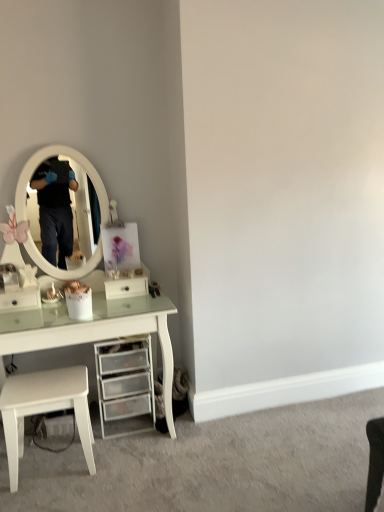
Question: Would you say white glossy drawer at center, the 1th drawer positioned from the right, is part of white glossy drawer at left, which appears as the 2th drawer when viewed from the right,'s contents?

Choices:
 (A) yes
 (B) no

Answer: (B)

Question: Could you tell me if white glossy drawer at left, which appears as the 2th drawer when viewed from the right, is turned towards white glossy drawer at center, the 1th drawer positioned from the right?

Choices:
 (A) no
 (B) yes

Answer: (A)

Question: From a real-world perspective, is white glossy drawer at left, which is the first drawer in left-to-right order, beneath white glossy drawer at center, marked as the second drawer in a left-to-right arrangement?

Choices:
 (A) yes
 (B) no

Answer: (B)

Question: Is white glossy drawer at left, which is the first drawer in left-to-right order, positioned with its back to white glossy drawer at center, marked as the second drawer in a left-to-right arrangement?

Choices:
 (A) no
 (B) yes

Answer: (A)

Question: Can you confirm if white glossy drawer at left, which is the first drawer in left-to-right order, is taller than white glossy drawer at center, marked as the second drawer in a left-to-right arrangement?

Choices:
 (A) yes
 (B) no

Answer: (A)

Question: From the image's perspective, is white glossy drawer at left, which appears as the 2th drawer when viewed from the right, located above white glossy drawer at center, marked as the second drawer in a left-to-right arrangement?

Choices:
 (A) yes
 (B) no

Answer: (B)

Question: Considering the relative positions of white glossy drawer at left, which is the first drawer in left-to-right order, and clear plastic drawers at lower center in the image provided, is white glossy drawer at left, which is the first drawer in left-to-right order, in front of clear plastic drawers at lower center?

Choices:
 (A) no
 (B) yes

Answer: (A)

Question: Are white glossy drawer at left, which appears as the 2th drawer when viewed from the right, and clear plastic drawers at lower center far apart?

Choices:
 (A) no
 (B) yes

Answer: (A)

Question: From the image's perspective, is white glossy drawer at left, which is the first drawer in left-to-right order, beneath clear plastic drawers at lower center?

Choices:
 (A) no
 (B) yes

Answer: (A)

Question: From the image's perspective, is white glossy drawer at left, which is the first drawer in left-to-right order, over clear plastic drawers at lower center?

Choices:
 (A) no
 (B) yes

Answer: (B)

Question: Considering the relative sizes of white glossy drawer at left, which appears as the 2th drawer when viewed from the right, and clear plastic drawers at lower center in the image provided, is white glossy drawer at left, which appears as the 2th drawer when viewed from the right, bigger than clear plastic drawers at lower center?

Choices:
 (A) no
 (B) yes

Answer: (A)

Question: Is white glossy drawer at left, which appears as the 2th drawer when viewed from the right, outside clear plastic drawers at lower center?

Choices:
 (A) no
 (B) yes

Answer: (B)

Question: Can you confirm if white glossy drawer at center, marked as the second drawer in a left-to-right arrangement, is wider than clear plastic drawers at lower center?

Choices:
 (A) no
 (B) yes

Answer: (A)